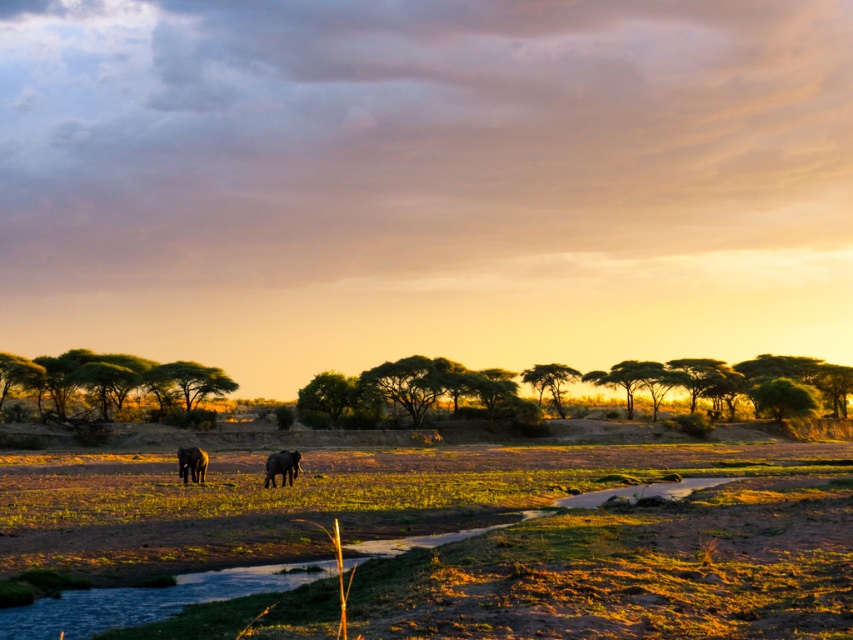
Is dark gray textured elephant at center wider than grayish-brown textured elephant at lower left?

Incorrect, dark gray textured elephant at center's width does not surpass grayish-brown textured elephant at lower left's.

Who is taller, dark gray textured elephant at center or grayish-brown textured elephant at lower left?

With more height is grayish-brown textured elephant at lower left.

Is point (289, 474) in front of point (184, 449)?

That is True.

Image resolution: width=853 pixels, height=640 pixels. In order to click on dark gray textured elephant at center in this screenshot , I will do `click(281, 467)`.